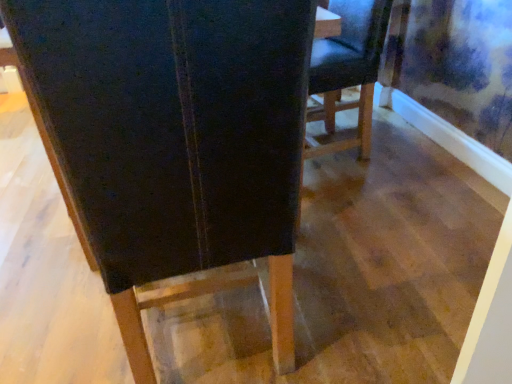
Locate an element on the screen. Image resolution: width=512 pixels, height=384 pixels. free spot to the right of black leather chair at center, the 2th chair positioned from the right is located at coordinates (362, 303).